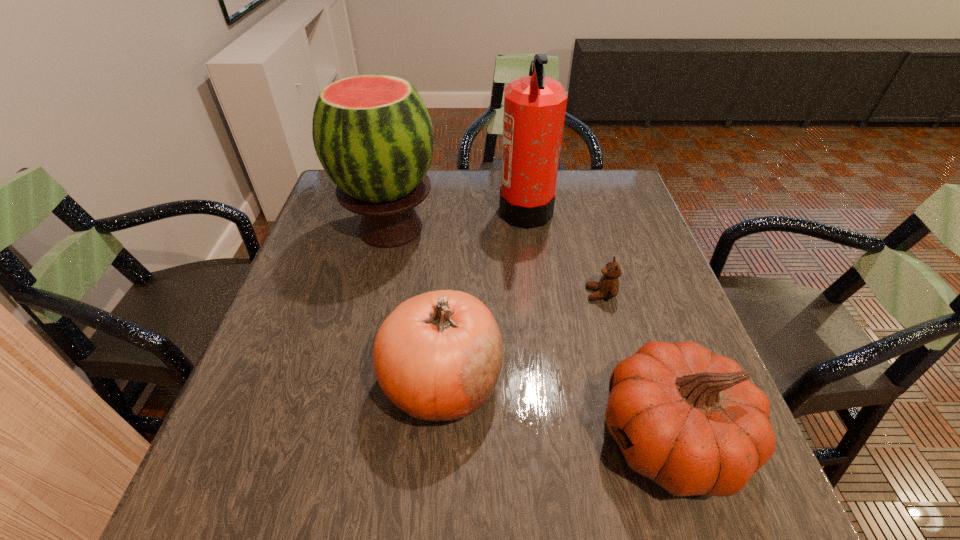
Locate an element on the screen. The height and width of the screenshot is (540, 960). free point located on the front of the watermelon is located at coordinates click(350, 399).

You are a GUI agent. You are given a task and a screenshot of the screen. Output one action in this format:
    pyautogui.click(x=<x>, y=<y>)
    Task: Click on the vacant space located on the left of the left pumpkin
    The height and width of the screenshot is (540, 960).
    Given the screenshot: What is the action you would take?
    pyautogui.click(x=259, y=381)

This screenshot has height=540, width=960. Find the location of `vacant position located 0.100m on the face of the right pumpkin`. vacant position located 0.100m on the face of the right pumpkin is located at coordinates tap(540, 438).

Identify the location of free spot located on the face of the right pumpkin. (426, 438).

Where is `vacant space located 0.180m on the face of the right pumpkin`? The image size is (960, 540). vacant space located 0.180m on the face of the right pumpkin is located at coordinates (494, 438).

Find the location of `vacant region located at the face of the shortest object`. vacant region located at the face of the shortest object is located at coordinates (458, 294).

At what (x,y) coordinates should I click in order to perform the action: click on free space located 0.070m at the face of the shortest object. Please return your answer as a coordinate pair (x, y). Looking at the image, I should click on (557, 294).

This screenshot has width=960, height=540. I want to click on free space located 0.380m at the face of the shortest object, so click(423, 294).

You are a GUI agent. You are given a task and a screenshot of the screen. Output one action in this format:
    pyautogui.click(x=<x>, y=<y>)
    Task: Click on the fire extinguisher that is at the far edge
    This screenshot has height=540, width=960.
    Given the screenshot: What is the action you would take?
    pyautogui.click(x=534, y=106)

The image size is (960, 540). Identify the location of watermelon that is at the far edge. (373, 135).